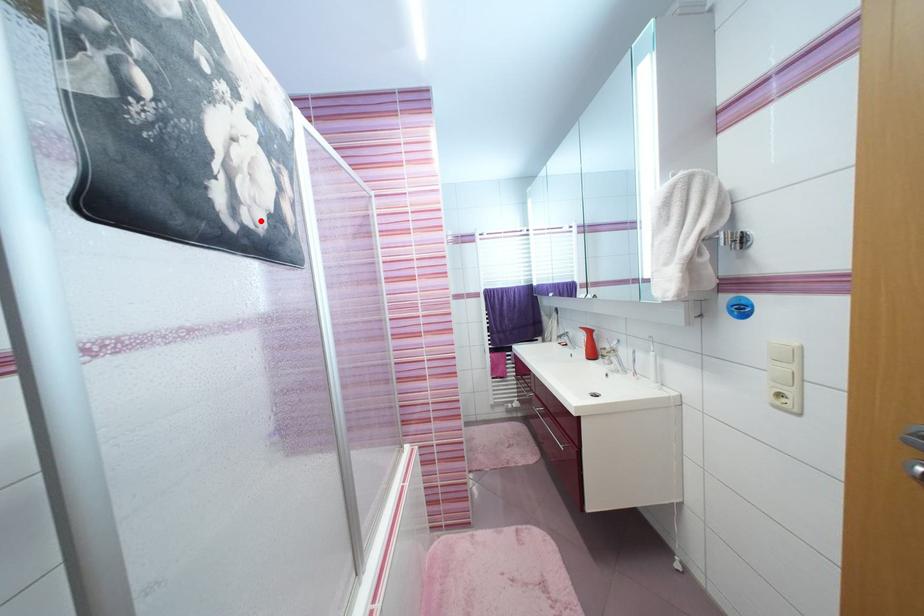
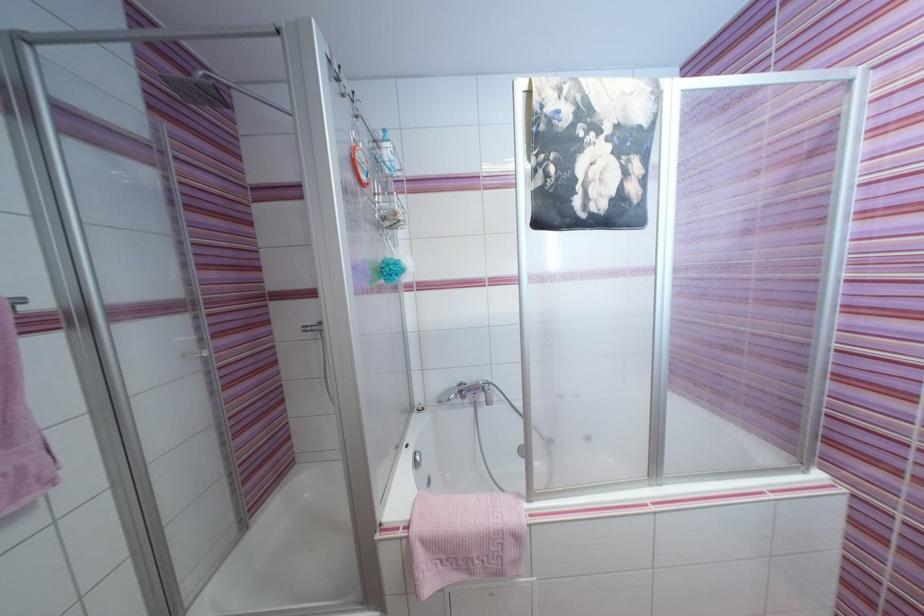
Question: I am providing you with two images of the same scene from different viewpoints. A red point is marked on the first image. Can you still see the location of the red point in image 2?

Choices:
 (A) Yes
 (B) No

Answer: (A)